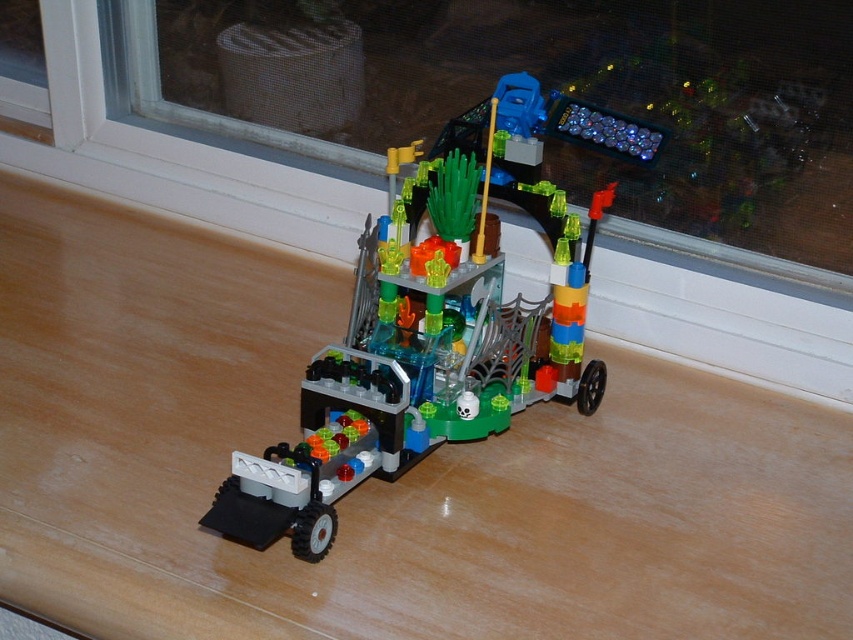
You are a toy repair technician who needs to fix the translucent plastic vehicle at center. The repair kit is on the transparent glass window at upper center. Can you reach the repair kit without moving the vehicle?

The distance between the translucent plastic vehicle at center and the transparent glass window at upper center is 41.99 centimeters. Since the repair kit is on the window, you can reach it by extending your arm or using a tool, as the distance is manageable for a person to access without moving the vehicle.

You are a child who wants to see the outside world through the transparent glass window at upper center while playing with the translucent plastic vehicle at center. Can you move the vehicle so that it doesn not block your view of the window?

The translucent plastic vehicle at center is positioned on the right side of transparent glass window at upper center, so moving it to the left would allow you to see the window without obstruction.